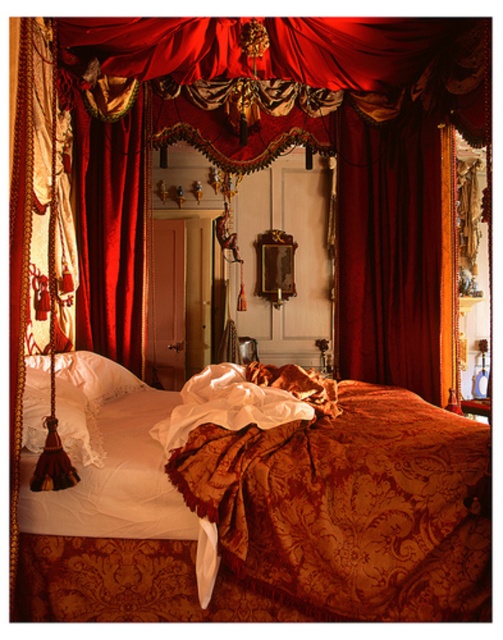
Question: Which point appears closest to the camera in this image?

Choices:
 (A) (398, 534)
 (B) (100, 340)
 (C) (412, 312)

Answer: (A)

Question: Which object is positioned closest to the velvet deep red curtain at center?

Choices:
 (A) velvet drapery at left
 (B) gold damask blanket at center

Answer: (B)

Question: Does gold damask blanket at center lie in front of velvet deep red curtain at center?

Choices:
 (A) yes
 (B) no

Answer: (A)

Question: In this image, where is gold damask blanket at center located relative to velvet deep red curtain at center?

Choices:
 (A) left
 (B) right

Answer: (A)

Question: Can you confirm if gold damask blanket at center is thinner than velvet drapery at left?

Choices:
 (A) yes
 (B) no

Answer: (B)

Question: Which object is the farthest from the velvet deep red curtain at center?

Choices:
 (A) gold damask blanket at center
 (B) velvet drapery at left

Answer: (B)